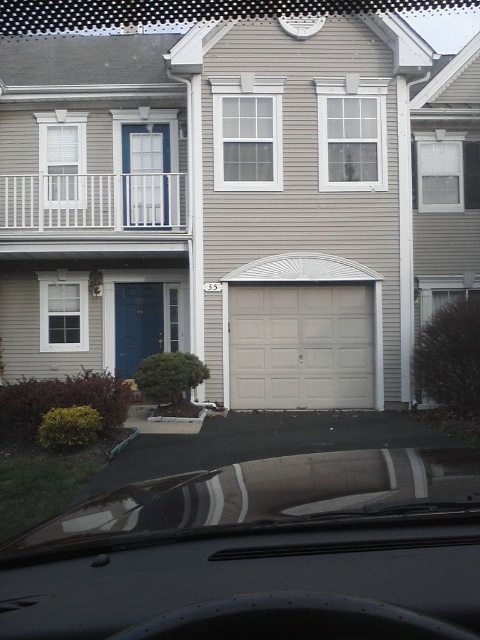
Question: Which point appears farthest from the camera in this image?

Choices:
 (A) (226, 481)
 (B) (332, 392)
 (C) (139, 570)

Answer: (B)

Question: Is black matte dashboard at lower center closer to camera compared to white smooth garage door at center?

Choices:
 (A) yes
 (B) no

Answer: (A)

Question: Does black matte dashboard at lower center have a smaller size compared to white smooth garage door at center?

Choices:
 (A) yes
 (B) no

Answer: (A)

Question: Is black matte dashboard at lower center positioned before white smooth garage door at center?

Choices:
 (A) yes
 (B) no

Answer: (A)

Question: Which of the following is the farthest from the observer?

Choices:
 (A) transparent glass windshield at center
 (B) black matte dashboard at lower center

Answer: (A)

Question: Among these objects, which one is farthest from the camera?

Choices:
 (A) black matte dashboard at lower center
 (B) white smooth garage door at center
 (C) transparent glass windshield at center

Answer: (B)